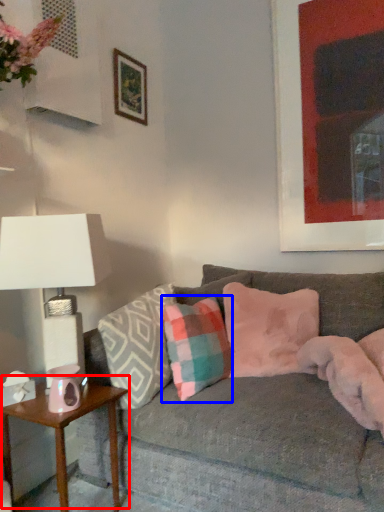
Question: Which point is further to the camera, table (highlighted by a red box) or pillow (highlighted by a blue box)?

Choices:
 (A) table
 (B) pillow

Answer: (B)